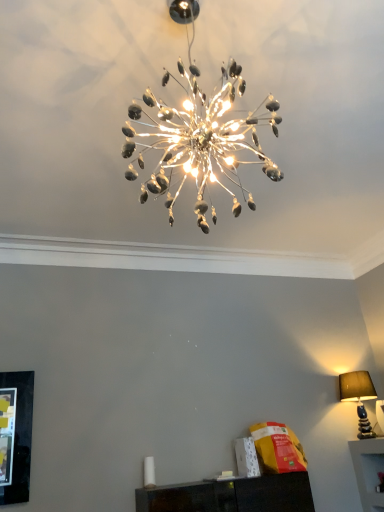
Where is `matte brown lampshade at right, positioned as the 1th lamp in back-to-front order`? matte brown lampshade at right, positioned as the 1th lamp in back-to-front order is located at coordinates (358, 398).

This screenshot has width=384, height=512. What do you see at coordinates (358, 398) in the screenshot?
I see `matte brown lampshade at right, which is the 2th lamp in left-to-right order` at bounding box center [358, 398].

The width and height of the screenshot is (384, 512). Describe the element at coordinates (200, 133) in the screenshot. I see `metallic silver chandelier at center, which is the 1th lamp from top to bottom` at that location.

Identify the location of metallic silver chandelier at center, which ranks as the 1th lamp in left-to-right order. The image size is (384, 512). (200, 133).

What are the coordinates of `matte brown lampshade at right, positioned as the 1th lamp in back-to-front order` in the screenshot? It's located at (358, 398).

Can you confirm if matte brown lampshade at right, marked as the first lamp in a right-to-left arrangement, is positioned to the left of metallic silver chandelier at center, which ranks as the 1th lamp in left-to-right order?

Incorrect, matte brown lampshade at right, marked as the first lamp in a right-to-left arrangement, is not on the left side of metallic silver chandelier at center, which ranks as the 1th lamp in left-to-right order.

Considering the relative positions of matte brown lampshade at right, the second lamp positioned from the top, and metallic silver chandelier at center, which is counted as the second lamp, starting from the right, in the image provided, is matte brown lampshade at right, the second lamp positioned from the top, in front of metallic silver chandelier at center, which is counted as the second lamp, starting from the right,?

No, matte brown lampshade at right, the second lamp positioned from the top, is behind metallic silver chandelier at center, which is counted as the second lamp, starting from the right.

Between point (343, 375) and point (132, 175), which one is positioned in front?

Point (132, 175)

From the image's perspective, which one is positioned lower, matte brown lampshade at right, which appears as the 2th lamp when viewed from the front, or metallic silver chandelier at center, placed as the second lamp when sorted from back to front?

From the image's view, matte brown lampshade at right, which appears as the 2th lamp when viewed from the front, is below.

From a real-world perspective, which is physically above, matte brown lampshade at right, positioned as the 1th lamp in back-to-front order, or metallic silver chandelier at center, which appears as the 2th lamp when ordered from the bottom?

metallic silver chandelier at center, which appears as the 2th lamp when ordered from the bottom.

Considering the sizes of matte brown lampshade at right, which is the first lamp in bottom-to-top order, and metallic silver chandelier at center, which is the 1th lamp from top to bottom, in the image, is matte brown lampshade at right, which is the first lamp in bottom-to-top order, wider or thinner than metallic silver chandelier at center, which is the 1th lamp from top to bottom,?

matte brown lampshade at right, which is the first lamp in bottom-to-top order, is thinner than metallic silver chandelier at center, which is the 1th lamp from top to bottom.

Is matte brown lampshade at right, positioned as the 1th lamp in back-to-front order, taller or shorter than metallic silver chandelier at center, which is the 1th lamp from top to bottom?

Clearly, matte brown lampshade at right, positioned as the 1th lamp in back-to-front order, is shorter compared to metallic silver chandelier at center, which is the 1th lamp from top to bottom.

Looking at the image, does matte brown lampshade at right, which appears as the 2th lamp when viewed from the front, seem bigger or smaller compared to metallic silver chandelier at center, which is counted as the second lamp, starting from the right?

Considering their sizes, matte brown lampshade at right, which appears as the 2th lamp when viewed from the front, takes up less space than metallic silver chandelier at center, which is counted as the second lamp, starting from the right.

Is matte brown lampshade at right, the second lamp positioned from the top, not within metallic silver chandelier at center, which is counted as the first lamp, starting from the front?

Absolutely, matte brown lampshade at right, the second lamp positioned from the top, is external to metallic silver chandelier at center, which is counted as the first lamp, starting from the front.

Would you say matte brown lampshade at right, which is the first lamp in bottom-to-top order, is a long distance from metallic silver chandelier at center, placed as the second lamp when sorted from back to front?

That's right, there is a large distance between matte brown lampshade at right, which is the first lamp in bottom-to-top order, and metallic silver chandelier at center, placed as the second lamp when sorted from back to front.

Is matte brown lampshade at right, which is the first lamp in bottom-to-top order, oriented away from metallic silver chandelier at center, placed as the second lamp when sorted from back to front?

matte brown lampshade at right, which is the first lamp in bottom-to-top order, does not have its back to metallic silver chandelier at center, placed as the second lamp when sorted from back to front.

Can you tell me how much matte brown lampshade at right, marked as the first lamp in a right-to-left arrangement, and metallic silver chandelier at center, which is the 1th lamp from top to bottom, differ in facing direction?

The angular difference between matte brown lampshade at right, marked as the first lamp in a right-to-left arrangement, and metallic silver chandelier at center, which is the 1th lamp from top to bottom, is 3.46 degrees.

How much distance is there between matte brown lampshade at right, positioned as the 1th lamp in back-to-front order, and metallic silver chandelier at center, which appears as the 2th lamp when ordered from the bottom?

matte brown lampshade at right, positioned as the 1th lamp in back-to-front order, is 2.43 meters away from metallic silver chandelier at center, which appears as the 2th lamp when ordered from the bottom.

The width and height of the screenshot is (384, 512). Find the location of `lamp on the left of matte brown lampshade at right, positioned as the 1th lamp in back-to-front order`. lamp on the left of matte brown lampshade at right, positioned as the 1th lamp in back-to-front order is located at coordinates click(x=200, y=133).

Is metallic silver chandelier at center, which appears as the 2th lamp when ordered from the bottom, at the right side of matte brown lampshade at right, the second lamp positioned from the top?

No, metallic silver chandelier at center, which appears as the 2th lamp when ordered from the bottom, is not to the right of matte brown lampshade at right, the second lamp positioned from the top.

Is the depth of metallic silver chandelier at center, which is counted as the second lamp, starting from the right, greater than that of matte brown lampshade at right, the second lamp positioned from the top?

No, metallic silver chandelier at center, which is counted as the second lamp, starting from the right, is closer to the camera.

Which is in front, point (208, 160) or point (357, 410)?

The point (208, 160) is closer to the camera.

From the image's perspective, which one is positioned higher, metallic silver chandelier at center, which is the 1th lamp from top to bottom, or matte brown lampshade at right, which appears as the 2th lamp when viewed from the front?

metallic silver chandelier at center, which is the 1th lamp from top to bottom, from the image's perspective.

From a real-world perspective, between metallic silver chandelier at center, which is counted as the first lamp, starting from the front, and matte brown lampshade at right, which appears as the 2th lamp when viewed from the front, who is vertically higher?

In real-world perspective, metallic silver chandelier at center, which is counted as the first lamp, starting from the front, is above.

Can you confirm if metallic silver chandelier at center, which appears as the 2th lamp when ordered from the bottom, is wider than matte brown lampshade at right, positioned as the 1th lamp in back-to-front order?

Indeed, metallic silver chandelier at center, which appears as the 2th lamp when ordered from the bottom, has a greater width compared to matte brown lampshade at right, positioned as the 1th lamp in back-to-front order.

Considering the relative sizes of metallic silver chandelier at center, which appears as the 2th lamp when ordered from the bottom, and matte brown lampshade at right, the second lamp positioned from the top, in the image provided, is metallic silver chandelier at center, which appears as the 2th lamp when ordered from the bottom, taller than matte brown lampshade at right, the second lamp positioned from the top,?

Yes.

In the scene shown: Considering the relative sizes of metallic silver chandelier at center, which is counted as the first lamp, starting from the front, and matte brown lampshade at right, the second lamp positioned from the top, in the image provided, is metallic silver chandelier at center, which is counted as the first lamp, starting from the front, smaller than matte brown lampshade at right, the second lamp positioned from the top,?

Actually, metallic silver chandelier at center, which is counted as the first lamp, starting from the front, might be larger than matte brown lampshade at right, the second lamp positioned from the top.

From the picture: Is matte brown lampshade at right, which appears as the 2th lamp when viewed from the front, surrounded by metallic silver chandelier at center, which is counted as the first lamp, starting from the front?

No, matte brown lampshade at right, which appears as the 2th lamp when viewed from the front, is not inside metallic silver chandelier at center, which is counted as the first lamp, starting from the front.

Is metallic silver chandelier at center, which appears as the 2th lamp when ordered from the bottom, placed right next to matte brown lampshade at right, the second lamp positioned from the top?

No, metallic silver chandelier at center, which appears as the 2th lamp when ordered from the bottom, is not making contact with matte brown lampshade at right, the second lamp positioned from the top.

Is metallic silver chandelier at center, which is counted as the first lamp, starting from the front, facing towards matte brown lampshade at right, positioned as the 1th lamp in back-to-front order?

No.

How many degrees apart are the facing directions of metallic silver chandelier at center, which appears as the 2th lamp when ordered from the bottom, and matte brown lampshade at right, which appears as the 2th lamp when viewed from the front?

The angular difference between metallic silver chandelier at center, which appears as the 2th lamp when ordered from the bottom, and matte brown lampshade at right, which appears as the 2th lamp when viewed from the front, is 3.46 degrees.

Measure the distance between metallic silver chandelier at center, which ranks as the 1th lamp in left-to-right order, and matte brown lampshade at right, positioned as the 1th lamp in back-to-front order.

They are 2.43 meters apart.

I want to click on lamp lying below the metallic silver chandelier at center, which appears as the 2th lamp when ordered from the bottom (from the image's perspective), so click(x=358, y=398).

The width and height of the screenshot is (384, 512). I want to click on lamp above the matte brown lampshade at right, positioned as the 1th lamp in back-to-front order (from a real-world perspective), so click(200, 133).

Where is `lamp that appears on the right of metallic silver chandelier at center, placed as the second lamp when sorted from back to front`? This screenshot has width=384, height=512. lamp that appears on the right of metallic silver chandelier at center, placed as the second lamp when sorted from back to front is located at coordinates (358, 398).